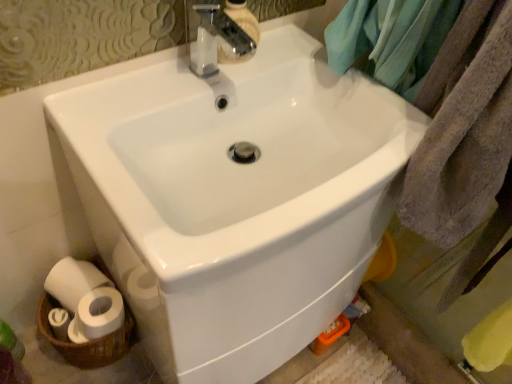
Identify the location of white ceramic tap at upper center. Image resolution: width=512 pixels, height=384 pixels. (217, 40).

The image size is (512, 384). What do you see at coordinates (217, 40) in the screenshot? I see `white ceramic tap at upper center` at bounding box center [217, 40].

At what (x,y) coordinates should I click in order to perform the action: click on white ceramic tap at upper center. Please return your answer as a coordinate pair (x, y). The image size is (512, 384). Looking at the image, I should click on (217, 40).